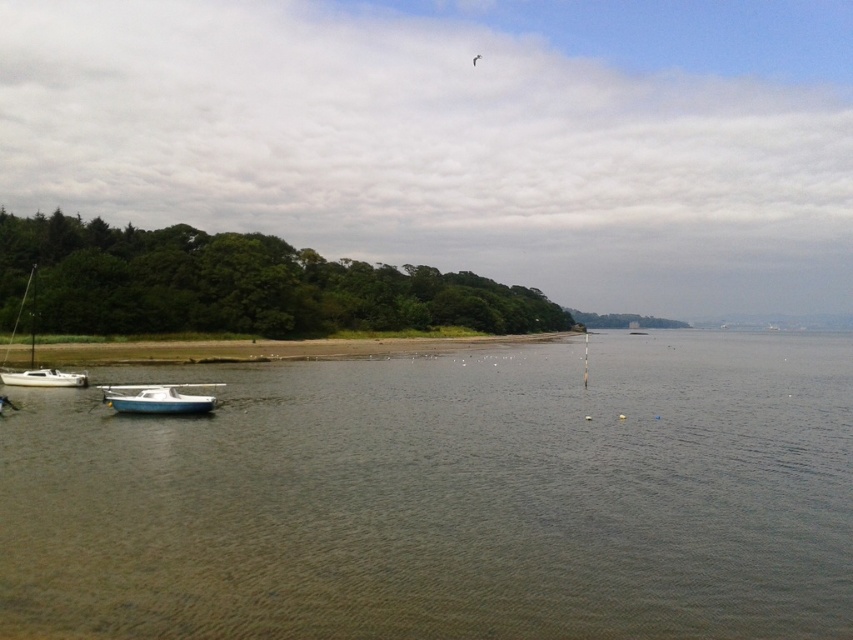
Question: Which object is closer to the camera taking this photo?

Choices:
 (A) white matte boat at lower left
 (B) brown matte water at center
 (C) green leafy trees at left
 (D) brown sand at lower center

Answer: (B)

Question: Is brown matte water at center smaller than white plastic boat at lower left?

Choices:
 (A) yes
 (B) no

Answer: (B)

Question: Can you confirm if brown sand at lower center is positioned to the right of white matte boat at lower left?

Choices:
 (A) no
 (B) yes

Answer: (B)

Question: Among these points, which one is nearest to the camera?

Choices:
 (A) click(700, 467)
 (B) click(399, 342)

Answer: (A)

Question: Based on their relative distances, which object is farther from the green leafy trees at left?

Choices:
 (A) white plastic boat at lower left
 (B) white matte sailboat at left
 (C) white matte boat at lower left
 (D) brown matte water at center

Answer: (A)

Question: In this image, where is green leafy trees at left located relative to white plastic boat at lower left?

Choices:
 (A) left
 (B) right

Answer: (B)